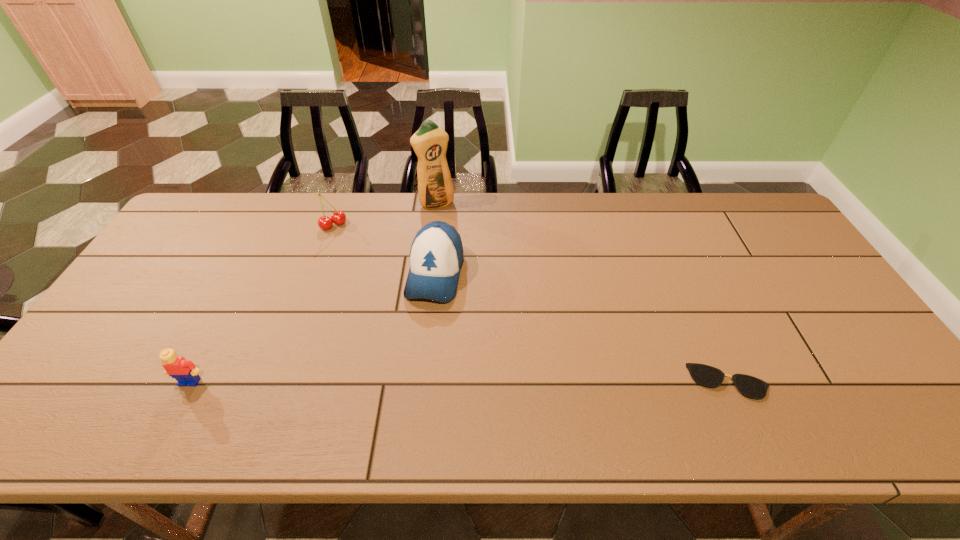
The height and width of the screenshot is (540, 960). I want to click on the leftmost object, so click(184, 371).

Where is `the rightmost object`? The width and height of the screenshot is (960, 540). the rightmost object is located at coordinates (705, 375).

Find the location of a particular element. spectacles is located at coordinates (705, 375).

Locate an element on the screen. This screenshot has width=960, height=540. the farthest object is located at coordinates (435, 188).

At what (x,y) coordinates should I click in order to perform the action: click on detergent. Please return your answer as a coordinate pair (x, y). The width and height of the screenshot is (960, 540). Looking at the image, I should click on (435, 188).

This screenshot has height=540, width=960. Find the location of `the second farthest object`. the second farthest object is located at coordinates (338, 217).

Where is `cherry`? This screenshot has height=540, width=960. cherry is located at coordinates (338, 217).

I want to click on baseball cap, so click(436, 256).

Find the location of a particular element. The image size is (960, 540). free location located 0.160m on the back of the shortest object is located at coordinates (698, 313).

Locate an element on the screen. Image resolution: width=960 pixels, height=540 pixels. free spot located 0.130m on the label of the farthest object is located at coordinates (455, 234).